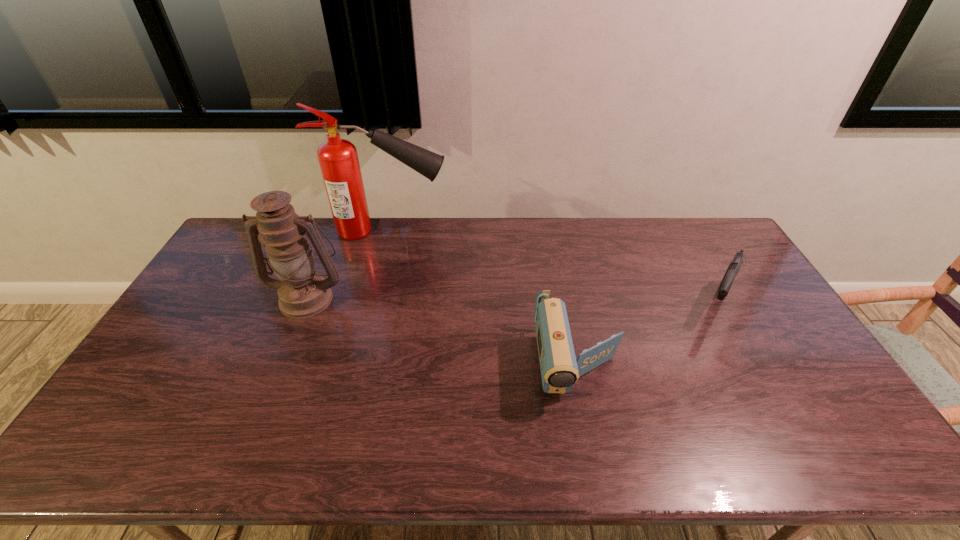
This screenshot has height=540, width=960. I want to click on empty space that is in between the oil lamp and the rightmost object, so click(512, 300).

Locate an element on the screen. The width and height of the screenshot is (960, 540). vacant area that lies between the second object from right to left and the third shortest object is located at coordinates (443, 331).

At what (x,y) coordinates should I click in order to perform the action: click on unoccupied area between the farthest object and the gun. Please return your answer as a coordinate pair (x, y). Looking at the image, I should click on (552, 267).

At what (x,y) coordinates should I click in order to perform the action: click on empty location between the camcorder and the oil lamp. Please return your answer as a coordinate pair (x, y). The image size is (960, 540). Looking at the image, I should click on (443, 331).

Where is `vacant area that lies between the tallest object and the camcorder`? vacant area that lies between the tallest object and the camcorder is located at coordinates (482, 298).

Locate an element on the screen. free spot between the rightmost object and the oil lamp is located at coordinates (512, 300).

In order to click on the third closest object to the tallest object in this screenshot , I will do `click(726, 283)`.

Where is `the second closest object relative to the tallest object`? Image resolution: width=960 pixels, height=540 pixels. the second closest object relative to the tallest object is located at coordinates (559, 369).

At what (x,y) coordinates should I click in order to perform the action: click on free point that satisfies the following two spatial constraints: 1. at the nozzle of the fire extinguisher; 2. on the front side of the third shortest object. Please return your answer as a coordinate pair (x, y). The image size is (960, 540). Looking at the image, I should click on (369, 298).